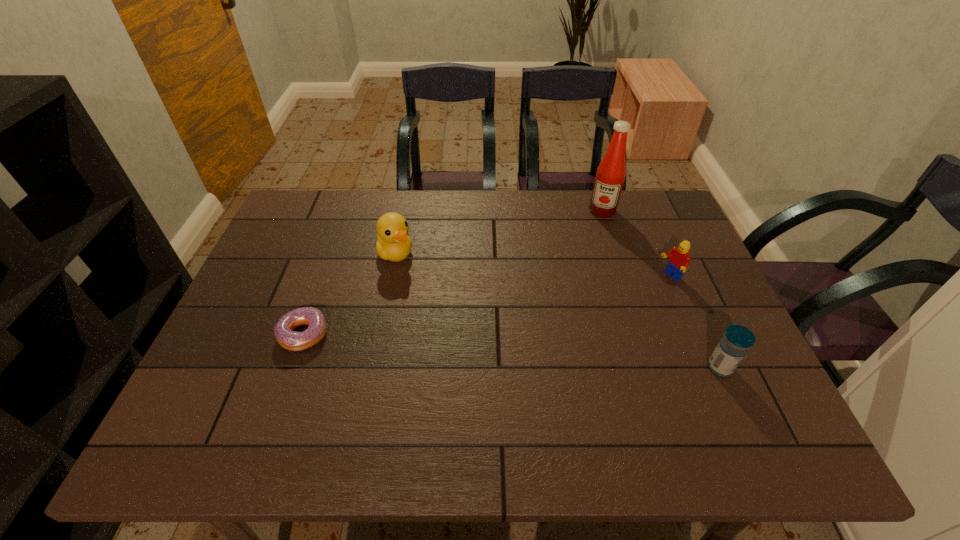
Where is `vacant space located on the face of the second object from left to right`? vacant space located on the face of the second object from left to right is located at coordinates (454, 310).

At what (x,y) coordinates should I click in order to perform the action: click on vacant region located on the face of the second object from left to right. Please return your answer as a coordinate pair (x, y). This screenshot has height=540, width=960. Looking at the image, I should click on (427, 285).

This screenshot has height=540, width=960. I want to click on free space located 0.050m on the face of the second object from left to right, so click(x=415, y=273).

This screenshot has height=540, width=960. In order to click on vacant point located 0.360m on the front-facing side of the Lego in this screenshot , I will do `click(564, 339)`.

The image size is (960, 540). Identify the location of vacant region located 0.120m on the front-facing side of the Lego. (633, 299).

You are a GUI agent. You are given a task and a screenshot of the screen. Output one action in this format:
    pyautogui.click(x=<x>, y=<y>)
    Task: Click on the vacant space located 0.210m on the front-facing side of the Lego
    
    Given the screenshot: What is the action you would take?
    pyautogui.click(x=608, y=313)

In order to click on vacant position located on the front-facing side of the tallest object in this screenshot , I will do `click(584, 267)`.

Locate an element on the screen. Image resolution: width=960 pixels, height=540 pixels. vacant space located 0.310m on the front-facing side of the tallest object is located at coordinates (578, 283).

Where is `vacant space situated on the front-facing side of the tallest object`? vacant space situated on the front-facing side of the tallest object is located at coordinates (570, 306).

I want to click on object that is at the far edge, so click(611, 172).